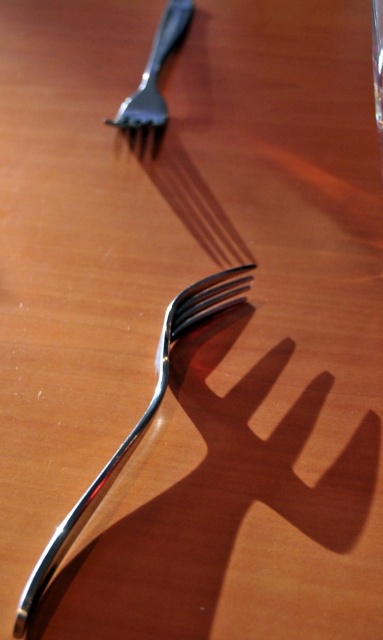
Question: Does polished metal fork at center have a lesser width compared to satin finish fork at upper left?

Choices:
 (A) yes
 (B) no

Answer: (B)

Question: Is polished metal fork at center behind satin finish fork at upper left?

Choices:
 (A) no
 (B) yes

Answer: (A)

Question: Observing the image, what is the correct spatial positioning of polished metal fork at center in reference to satin finish fork at upper left?

Choices:
 (A) right
 (B) left

Answer: (A)